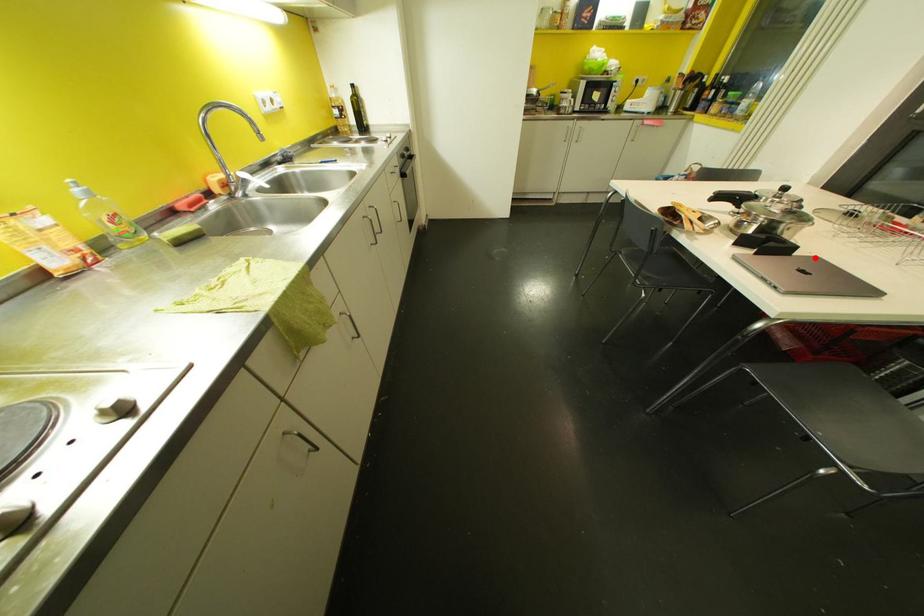
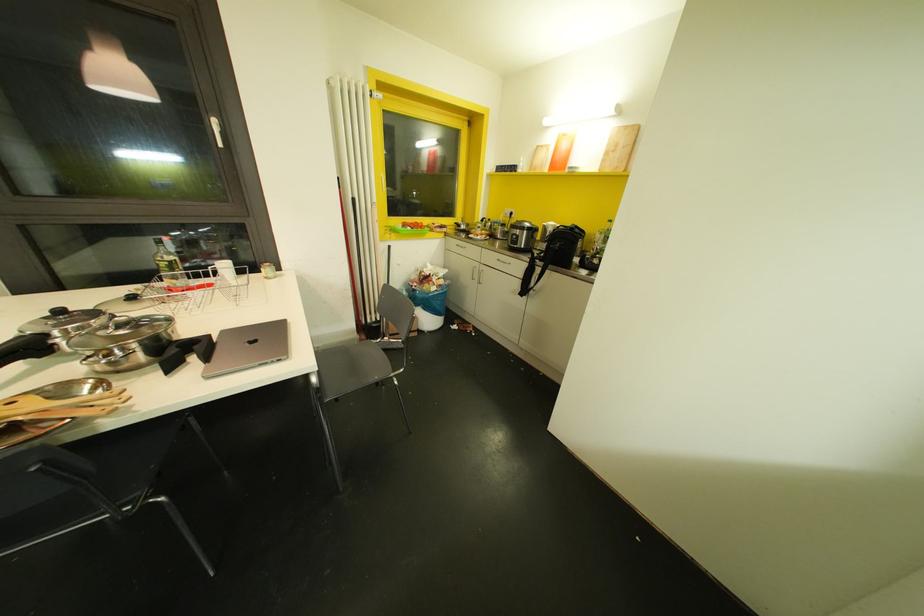
Locate, in the second image, the point that corresponds to the highlighted location in the first image.

(223, 331)